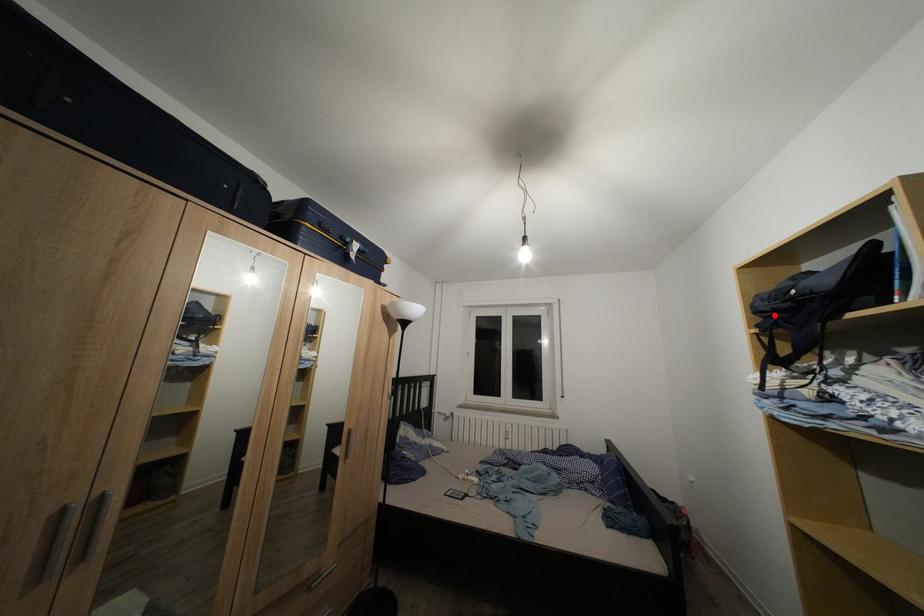
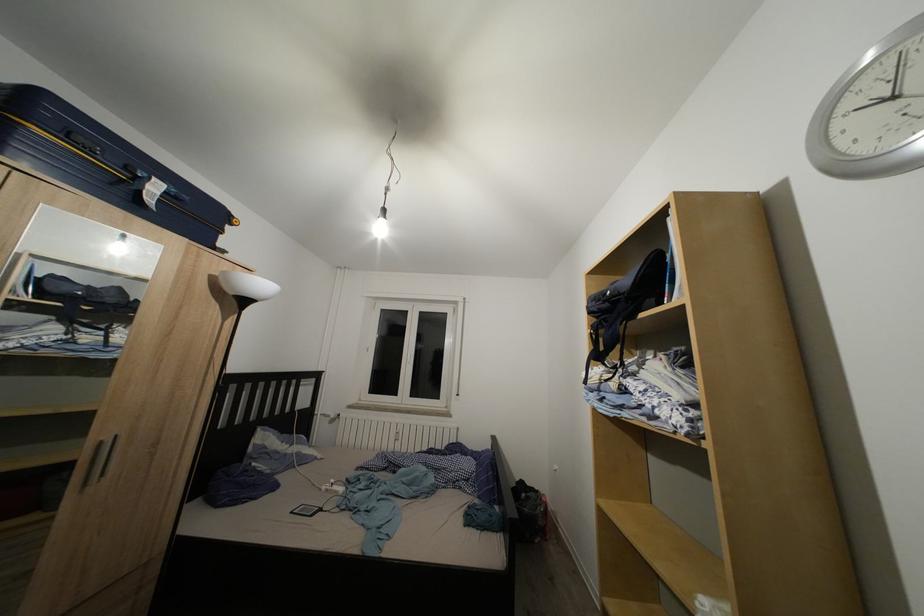
Question: I am providing you with two images of the same scene from different viewpoints. A red point is marked on the first image. At the location where the point appears in image 1, is it still visible in image 2?

Choices:
 (A) Yes
 (B) No

Answer: (A)